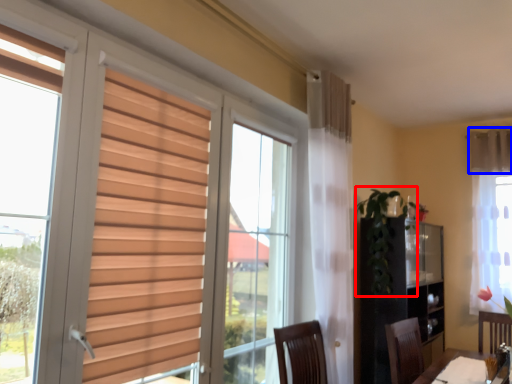
Question: Which object is further to the camera taking this photo, plant (highlighted by a red box) or curtain (highlighted by a blue box)?

Choices:
 (A) plant
 (B) curtain

Answer: (B)